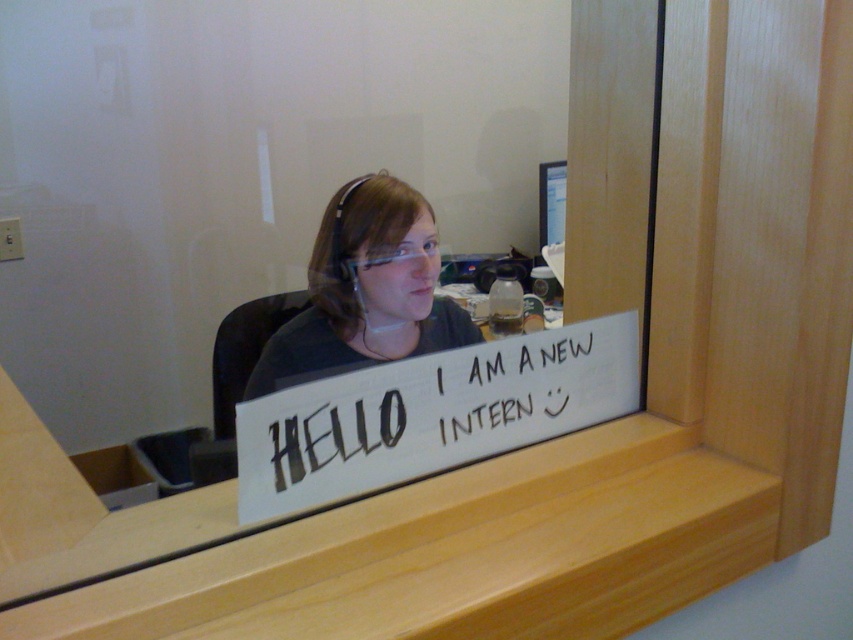
Does point (408, 388) come behind point (366, 266)?

No, (408, 388) is closer to viewer.

Is point (346, 429) less distant than point (363, 269)?

Yes, point (346, 429) is closer to viewer.

You are a GUI agent. You are given a task and a screenshot of the screen. Output one action in this format:
    pyautogui.click(x=<x>, y=<y>)
    Task: Click on the white paper sign at center
    This screenshot has width=853, height=640.
    Given the screenshot: What is the action you would take?
    pyautogui.click(x=428, y=413)

Between point (396, 296) and point (396, 259), which one is positioned in front?

Point (396, 296) is more forward.

Consider the image. Who is taller, matte black shirt at center or clear plastic goggles at center?

With more height is matte black shirt at center.

Which is behind, point (360, 364) or point (358, 262)?

Positioned behind is point (360, 364).

At what (x,y) coordinates should I click in order to perform the action: click on matte black shirt at center. Please return your answer as a coordinate pair (x, y). The width and height of the screenshot is (853, 640). Looking at the image, I should click on [x=366, y=291].

Measure the distance from white paper sign at center to matte black shirt at center.

white paper sign at center and matte black shirt at center are 80.66 centimeters apart from each other.

Between white paper sign at center and matte black shirt at center, which one is positioned higher?

matte black shirt at center

The width and height of the screenshot is (853, 640). What are the coordinates of `white paper sign at center` in the screenshot? It's located at (428, 413).